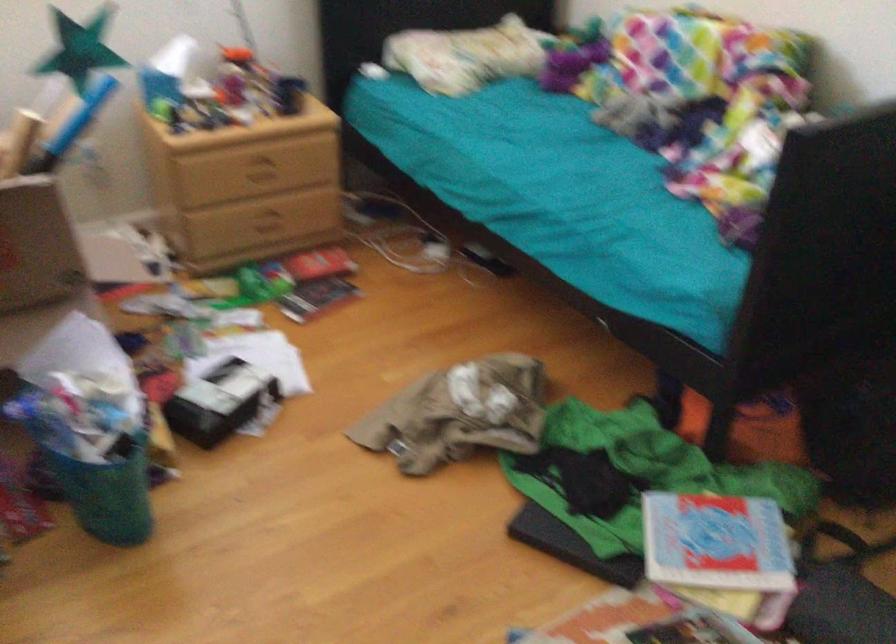
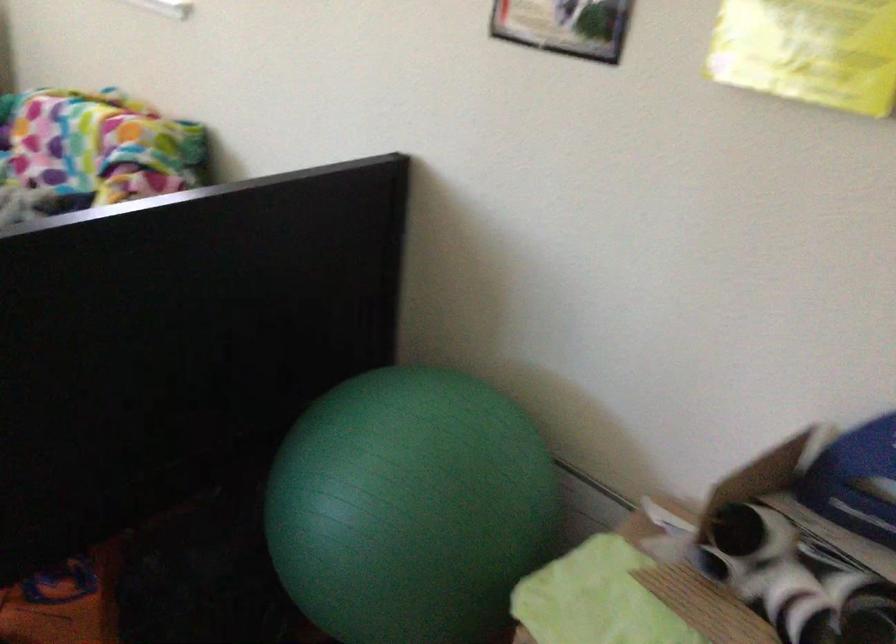
Question: In a continuous first-person perspective shot, in which direction is the camera moving?

Choices:
 (A) Left
 (B) Right
 (C) Forward
 (D) Backward

Answer: (B)